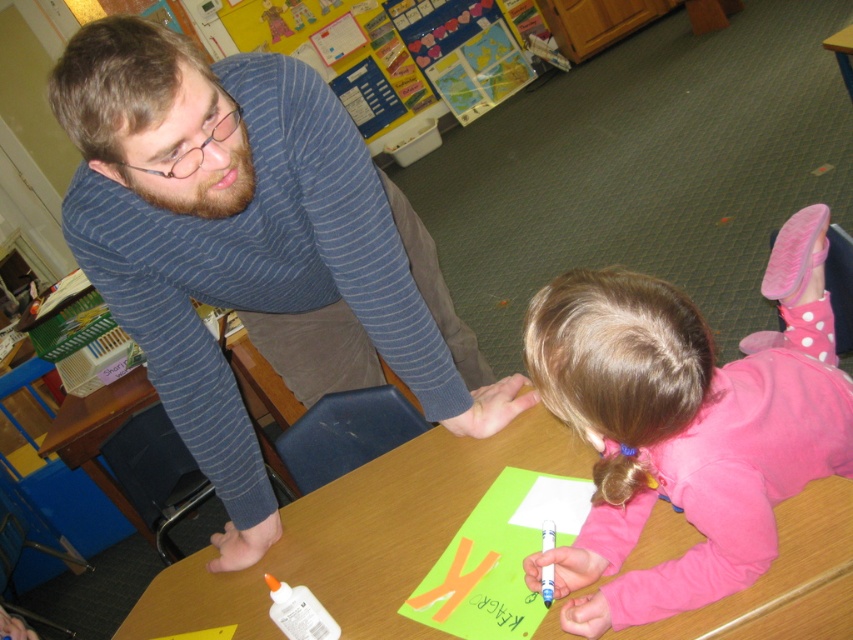
You are a student sitting at the wooden table at center and want to hand your paper to the adult wearing the blue striped sweater at upper left. Which direction should you move to get closer to them?

The blue striped sweater at upper left is closer to the viewer than the wooden table at center, so you should move towards the direction of the blue striped sweater at upper left to get closer to them.

You are standing in the classroom and want to reach the point at coordinates point (x=753, y=506). If you can reach up to 1 meter, will you be able to reach it?

The distance of point (x=753, y=506) from viewer is 92.99 centimeters, so yes, you can reach it since it is within your 1 meter reach.

You are standing in front of the classroom scene. You see the blue striped sweater at upper left and the pink fleece shirt at lower right. Which one is positioned more to the left side of the image?

The blue striped sweater at upper left is positioned more to the left side of the image than the pink fleece shirt at lower right.